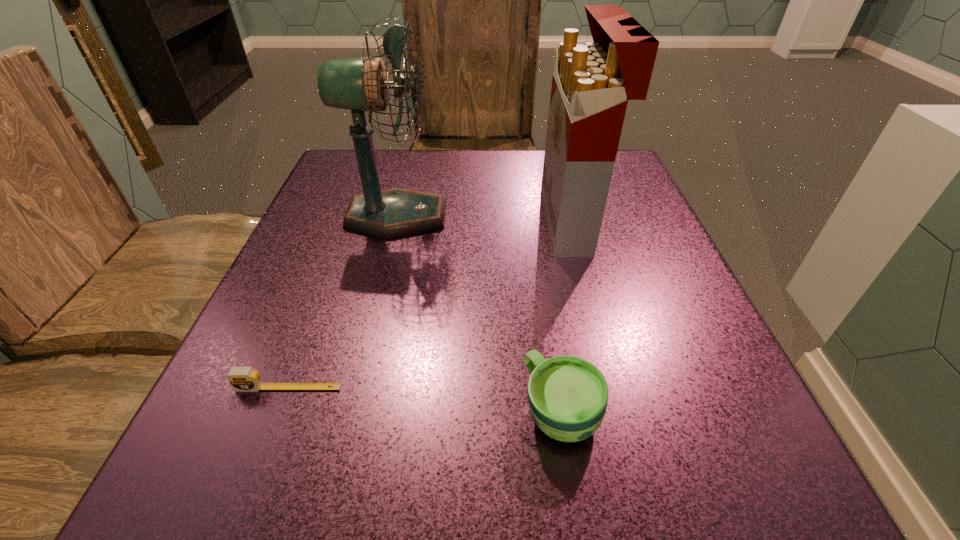
This screenshot has width=960, height=540. In order to click on fan in this screenshot , I will do 359,84.

I want to click on cigarette case, so click(x=591, y=85).

Image resolution: width=960 pixels, height=540 pixels. In order to click on cup in this screenshot , I will do `click(568, 396)`.

You are a GUI agent. You are given a task and a screenshot of the screen. Output one action in this format:
    pyautogui.click(x=<x>, y=<y>)
    Task: Click on the tape measure
    The width and height of the screenshot is (960, 540).
    Given the screenshot: What is the action you would take?
    pyautogui.click(x=242, y=379)

I want to click on free location located 0.150m in front of the fan where the wind blows, so click(519, 216).

Image resolution: width=960 pixels, height=540 pixels. In order to click on blank space located 0.200m with the lid open on the cigarette case in this screenshot , I will do pyautogui.click(x=446, y=222).

Locate an element on the screen. This screenshot has width=960, height=540. free spot located 0.210m with the lid open on the cigarette case is located at coordinates (441, 222).

This screenshot has height=540, width=960. In order to click on vacant region located 0.250m with the lid open on the cigarette case in this screenshot , I will do `click(421, 222)`.

This screenshot has width=960, height=540. Find the location of `free location located on the left of the cup`. free location located on the left of the cup is located at coordinates (392, 411).

Image resolution: width=960 pixels, height=540 pixels. Identify the location of fan that is positioned at the far edge. (359, 84).